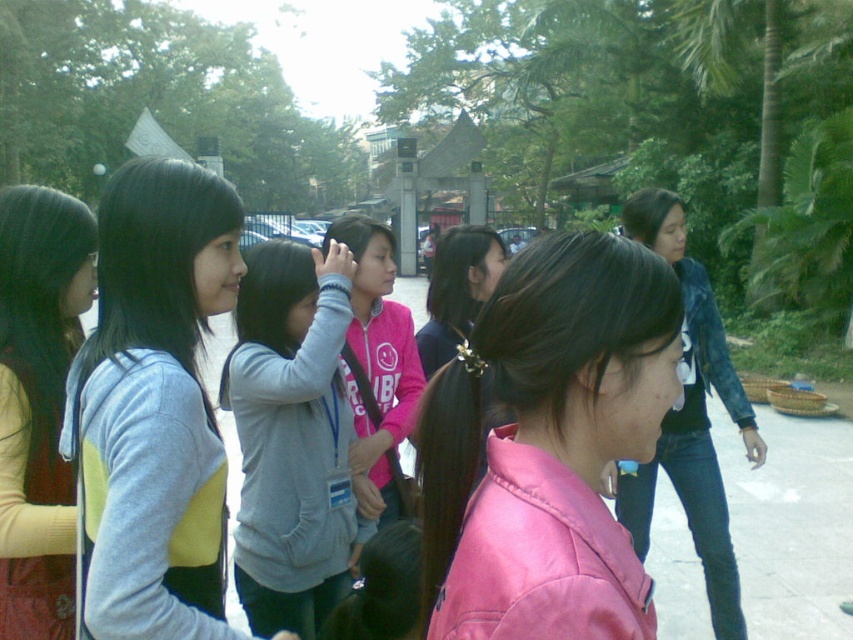
You are organizing a clothing display and need to arrange the light blue fleece jacket at left and the matte yellow sweater at left side by side. Based on their widths, which one should be placed on the wider side of the display?

The light blue fleece jacket at left should be placed on the wider side of the display since its width surpasses that of the matte yellow sweater at left.

You are organizing a photo shoot and need to arrange two models wearing the matte yellow sweater at left and pink matte jacket at center. Based on their heights, which model should stand in the front to ensure both are visible in the photo?

The matte yellow sweater at left should stand in the front because it has a lesser height compared to the pink matte jacket at center, ensuring both models are visible.

You are a photographer trying to capture a group photo of the light blue fleece jacket at left and the matte yellow sweater at left. Since you want both subjects to be clearly visible in the photo, which one should you focus on first to ensure depth of field?

You should focus on the light blue fleece jacket at left first because it is in front of the matte yellow sweater at left, ensuring both will be in focus when focusing on the closer subject.